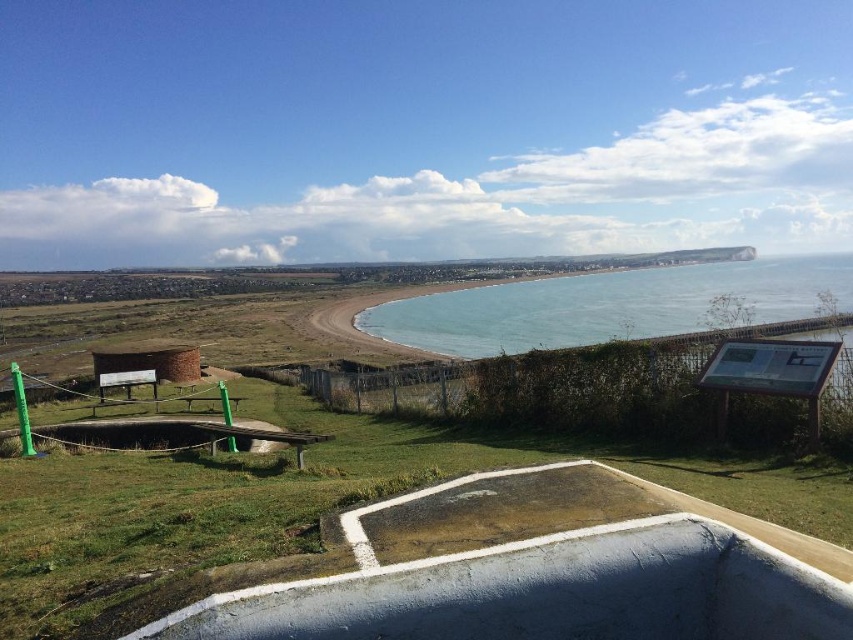
Is point (631, 289) positioned after point (199, 365)?

That is True.

Does blue water at center have a greater width compared to brick-red brick hut at lower left?

Yes.

Is point (621, 292) positioned in front of point (138, 340)?

No, it is not.

At what (x,y) coordinates should I click in order to perform the action: click on blue water at center. Please return your answer as a coordinate pair (x, y). Image resolution: width=853 pixels, height=640 pixels. Looking at the image, I should click on (607, 305).

Is green grassy at lower left bigger than brick-red brick hut at lower left?

Correct, green grassy at lower left is larger in size than brick-red brick hut at lower left.

Between green grassy at lower left and brick-red brick hut at lower left, which one has less height?

brick-red brick hut at lower left

Describe the element at coordinates (283, 508) in the screenshot. I see `green grassy at lower left` at that location.

Identify the location of green grassy at lower left. (283, 508).

Is green grassy at lower left closer to the viewer compared to blue water at center?

Yes, it is.

Which is more to the left, green grassy at lower left or blue water at center?

green grassy at lower left

Consider the image. Who is more forward, (38, 545) or (387, 312)?

Point (38, 545)

Where is `green grassy at lower left`? The width and height of the screenshot is (853, 640). green grassy at lower left is located at coordinates (283, 508).